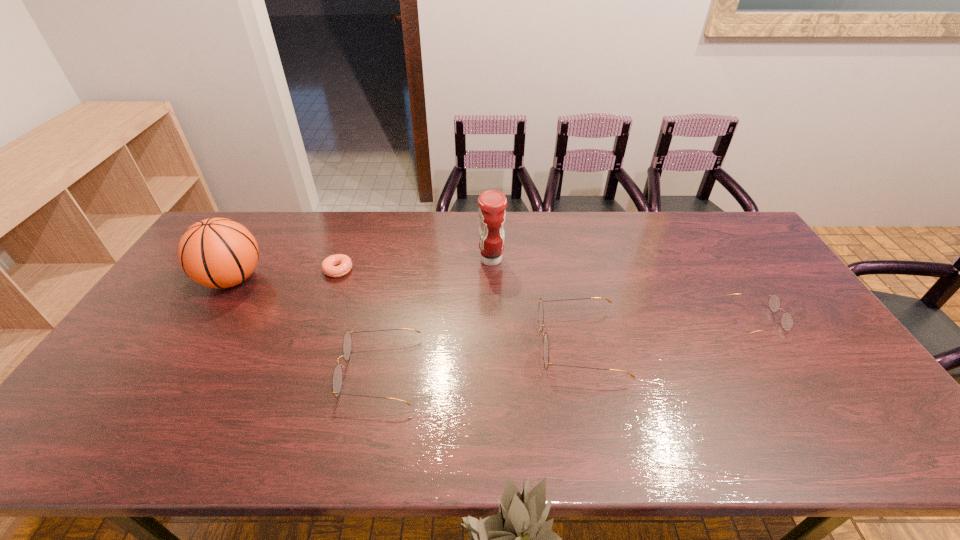
Identify the location of free spot between the basketball and the doughnut. (285, 274).

Where is `free spot between the second shortest object and the basketball`? free spot between the second shortest object and the basketball is located at coordinates (494, 299).

Identify the location of free spot between the fifth object from left to right and the basketball. (406, 312).

Locate an element on the screen. The width and height of the screenshot is (960, 540). vacant area that lies between the fifth object from right to left and the fifth object from left to right is located at coordinates (459, 307).

Where is `vacant space in between the condiment and the leftmost spectacles`? vacant space in between the condiment and the leftmost spectacles is located at coordinates (436, 316).

At what (x,y) coordinates should I click in order to perform the action: click on vacant area that lies between the shortest object and the condiment. Please return your answer as a coordinate pair (x, y). The height and width of the screenshot is (540, 960). Looking at the image, I should click on (415, 265).

Identify the location of free space that is in between the second shortest object and the basketball. (494, 299).

Locate which object is the second closest to the third object from right to left. Please provide its 2D coordinates. Your answer should be formatted as a tuple, i.e. [(x, y)], where the tuple contains the x and y coordinates of a point satisfying the conditions above.

[(337, 379)]

This screenshot has width=960, height=540. Find the location of `object that can be found as the third closest to the fourth object from left to right`. object that can be found as the third closest to the fourth object from left to right is located at coordinates (329, 267).

Locate an element on the screen. The height and width of the screenshot is (540, 960). spectacles that is the third closest to the leftmost object is located at coordinates (787, 321).